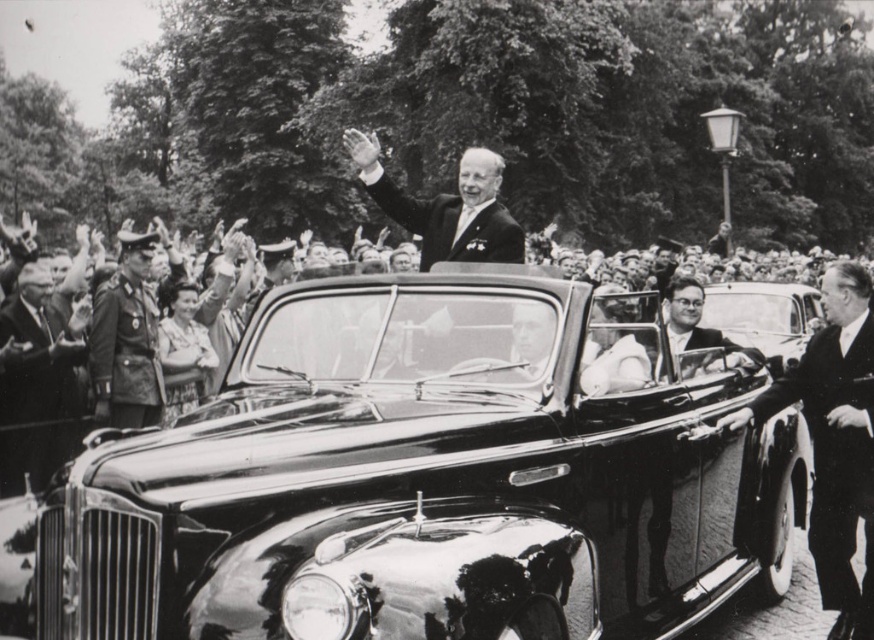
You are a photographer trying to capture a clear shot of the shiny black car at center and the dark brown leather uniform at left. Based on their positions, which object is closer to the left edge of the photo?

The dark brown leather uniform at left is closer to the left edge of the photo because the shiny black car at center is to the right of it.

You are a photographer trying to capture a clear shot of both the smooth black suit at right and the dark brown leather uniform at left. Since you can only focus on one subject at a time, which one should you choose to ensure the other is still somewhat in focus?

The smooth black suit at right is closer to the viewer than the dark brown leather uniform at left. To ensure the other is somewhat in focus, you should focus on the smooth black suit at right because it is closer, and the depth of field may extend to include the dark brown leather uniform at left in the background.

You are a photographer trying to capture a clear photo of both the shiny black car at center and the smooth black suit at right. Can you fit both objects in your camera frame if your camera has a maximum viewing angle that can cover 1.5 meters width?

The shiny black car at center and smooth black suit at right are 1.46 meters apart, so yes, both objects can be captured in the camera frame since the distance between them is within the 1.5 meters coverage.